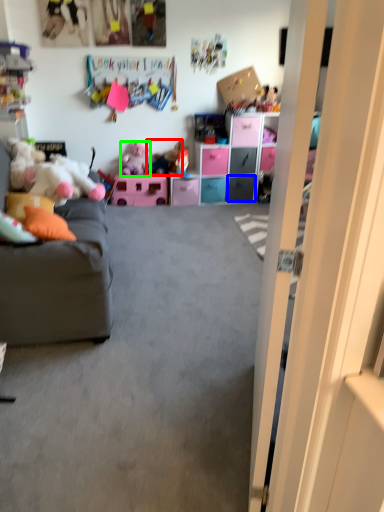
Question: Which is farther away from toy (highlighted by a red box)? drawer (highlighted by a blue box) or toy (highlighted by a green box)?

Choices:
 (A) drawer
 (B) toy

Answer: (A)